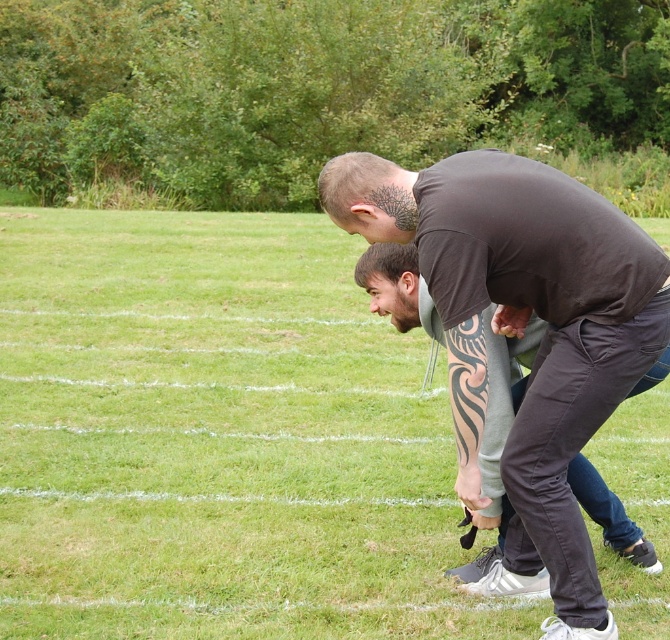
Question: Is green grass at center further to the viewer compared to dark brown t-shirt at center?

Choices:
 (A) yes
 (B) no

Answer: (A)

Question: Which object appears farthest from the camera in this image?

Choices:
 (A) dark brown t-shirt at center
 (B) green grass at center

Answer: (B)

Question: Where is green grass at center located in relation to dark brown t-shirt at center in the image?

Choices:
 (A) left
 (B) right

Answer: (A)

Question: Can you confirm if green grass at center is smaller than dark brown t-shirt at center?

Choices:
 (A) no
 (B) yes

Answer: (A)

Question: Which of the following is the closest to the observer?

Choices:
 (A) green grass at center
 (B) dark brown t-shirt at center

Answer: (B)